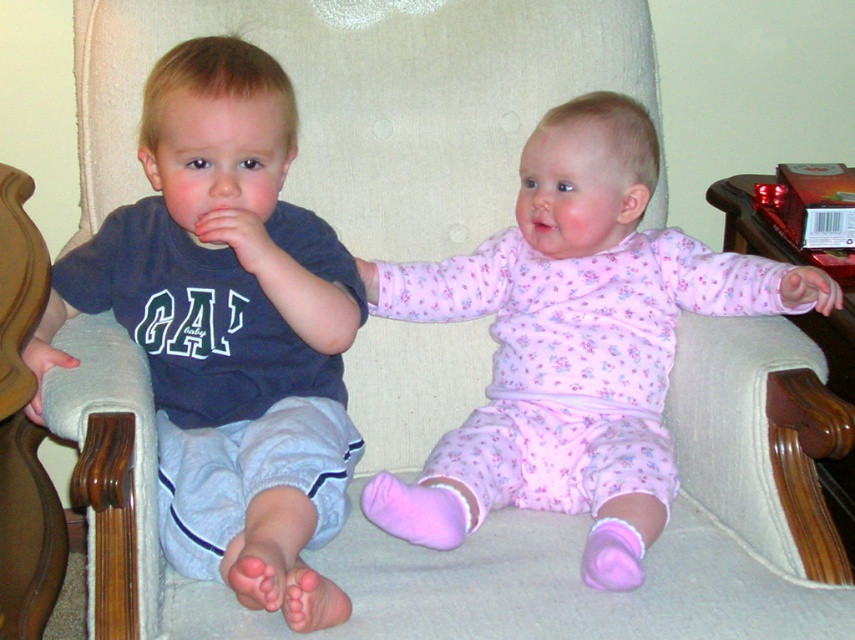
Is matte blue shirt at left to the right of pink floral pajamas at center from the viewer's perspective?

In fact, matte blue shirt at left is to the left of pink floral pajamas at center.

How far apart are matte blue shirt at left and pink floral pajamas at center?

The distance of matte blue shirt at left from pink floral pajamas at center is 9.58 inches.

Is point (219, 397) farther from viewer compared to point (407, 531)?

Yes.

You are a GUI agent. You are given a task and a screenshot of the screen. Output one action in this format:
    pyautogui.click(x=<x>, y=<y>)
    Task: Click on the matte blue shirt at left
    The image size is (855, 640).
    Given the screenshot: What is the action you would take?
    pyautogui.click(x=228, y=330)